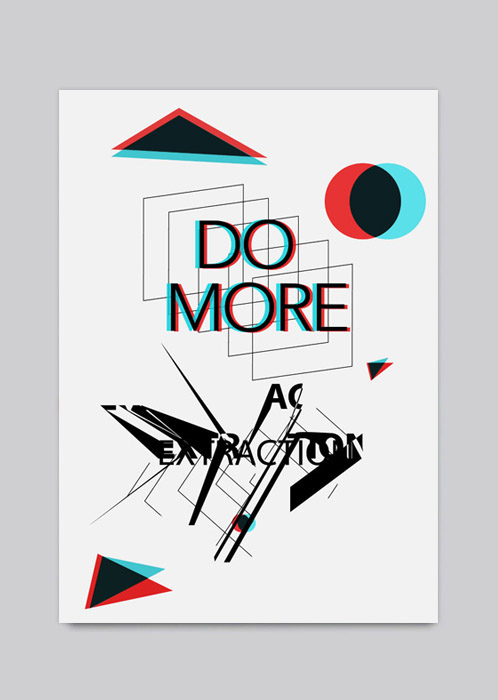
The width and height of the screenshot is (498, 700). What are the coordinates of `ac` in the screenshot? It's located at (277, 400).